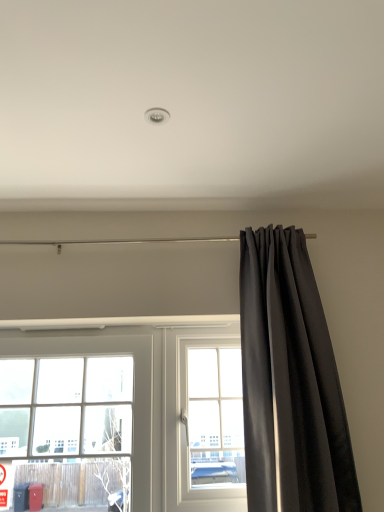
Question: Considering the positions of clear glass window at left, the first window when ordered from left to right, and clear glass window at center, arranged as the 2th window when viewed from the left, in the image, is clear glass window at left, the first window when ordered from left to right, taller or shorter than clear glass window at center, arranged as the 2th window when viewed from the left,?

Choices:
 (A) short
 (B) tall

Answer: (B)

Question: Looking at the image, does clear glass window at left, the first window when ordered from left to right, seem bigger or smaller compared to clear glass window at center, which ranks as the first window in right-to-left order?

Choices:
 (A) big
 (B) small

Answer: (A)

Question: Estimate the real-world distances between objects in this image. Which object is closer to the clear glass window at left, the first window when ordered from left to right?

Choices:
 (A) black velvet curtain at right
 (B) clear glass window at center, arranged as the 2th window when viewed from the left

Answer: (B)

Question: Which object is the farthest from the clear glass window at center, arranged as the 2th window when viewed from the left?

Choices:
 (A) black velvet curtain at right
 (B) clear glass window at left, the 2th window positioned from the right

Answer: (A)